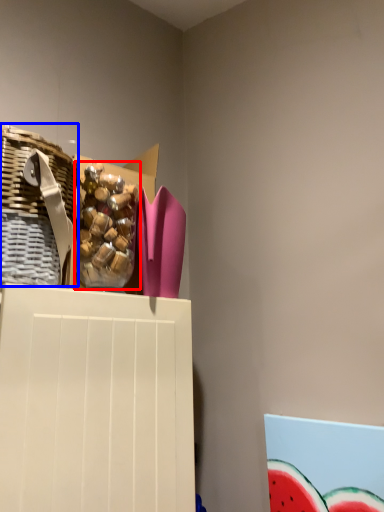
Question: Which object is further to the camera taking this photo, food (highlighted by a red box) or basket (highlighted by a blue box)?

Choices:
 (A) food
 (B) basket

Answer: (A)